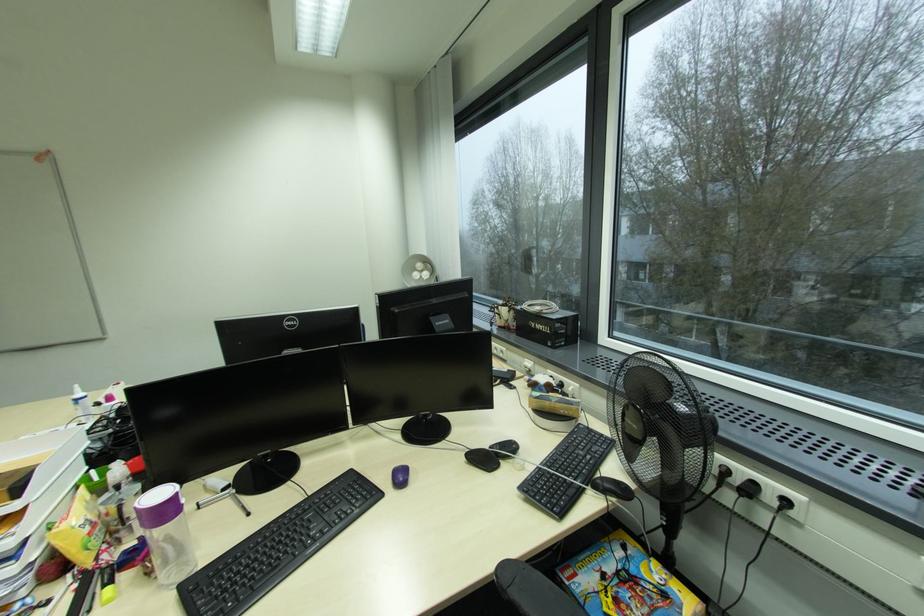
Describe the element at coordinates (625, 582) in the screenshot. Image resolution: width=924 pixels, height=616 pixels. I see `the yellow LEGO box` at that location.